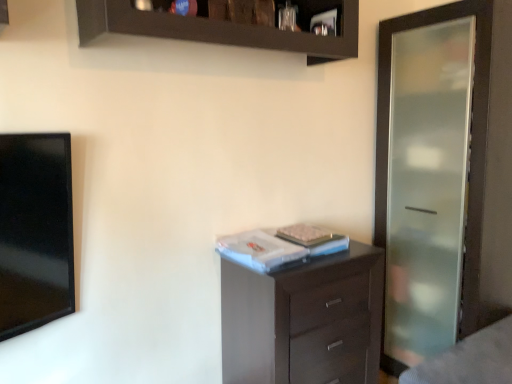
Question: Could you tell me if white matte book at center is turned towards dark wood chest of drawers at center?

Choices:
 (A) no
 (B) yes

Answer: (A)

Question: Is white matte book at center bigger than dark wood chest of drawers at center?

Choices:
 (A) no
 (B) yes

Answer: (A)

Question: Could dark wood chest of drawers at center be considered to be inside white matte book at center?

Choices:
 (A) yes
 (B) no

Answer: (B)

Question: Can you confirm if white matte book at center is wider than dark wood chest of drawers at center?

Choices:
 (A) yes
 (B) no

Answer: (B)

Question: Is the depth of white matte book at center less than that of dark wood chest of drawers at center?

Choices:
 (A) yes
 (B) no

Answer: (B)

Question: Is white matte book at center not inside dark wood chest of drawers at center?

Choices:
 (A) no
 (B) yes

Answer: (B)

Question: Does dark wood shelf at upper center have a greater width compared to white matte book at center?

Choices:
 (A) yes
 (B) no

Answer: (B)

Question: Considering the relative positions of dark wood shelf at upper center and white matte book at center in the image provided, is dark wood shelf at upper center to the right of white matte book at center from the viewer's perspective?

Choices:
 (A) yes
 (B) no

Answer: (B)

Question: Is dark wood shelf at upper center not inside white matte book at center?

Choices:
 (A) no
 (B) yes

Answer: (B)

Question: From the image's perspective, is dark wood shelf at upper center located beneath white matte book at center?

Choices:
 (A) no
 (B) yes

Answer: (A)

Question: Is dark wood shelf at upper center looking in the opposite direction of white matte book at center?

Choices:
 (A) yes
 (B) no

Answer: (B)

Question: Does dark wood shelf at upper center appear on the left side of white matte book at center?

Choices:
 (A) no
 (B) yes

Answer: (B)

Question: Considering the relative sizes of frosted glass screen door at right and dark wood chest of drawers at center in the image provided, is frosted glass screen door at right shorter than dark wood chest of drawers at center?

Choices:
 (A) yes
 (B) no

Answer: (B)